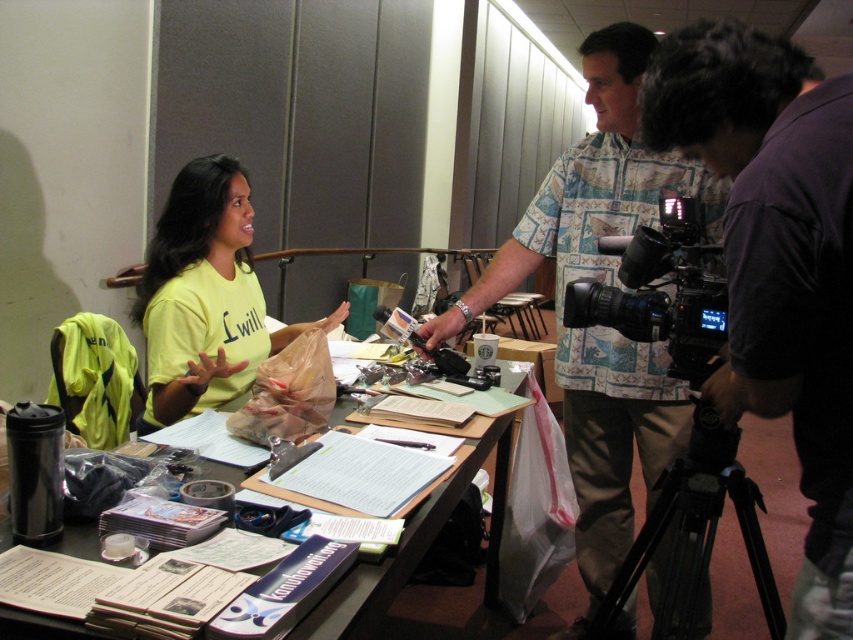
You are setting up equipment for a video recording session in the conference room. You have a black metal tripod at lower right and a black matte video camera at center. Which object should you adjust first to ensure proper positioning for the camera?

You should adjust the black metal tripod at lower right first because it is larger in size than the black matte video camera at center, making it easier to position before placing the camera on top.